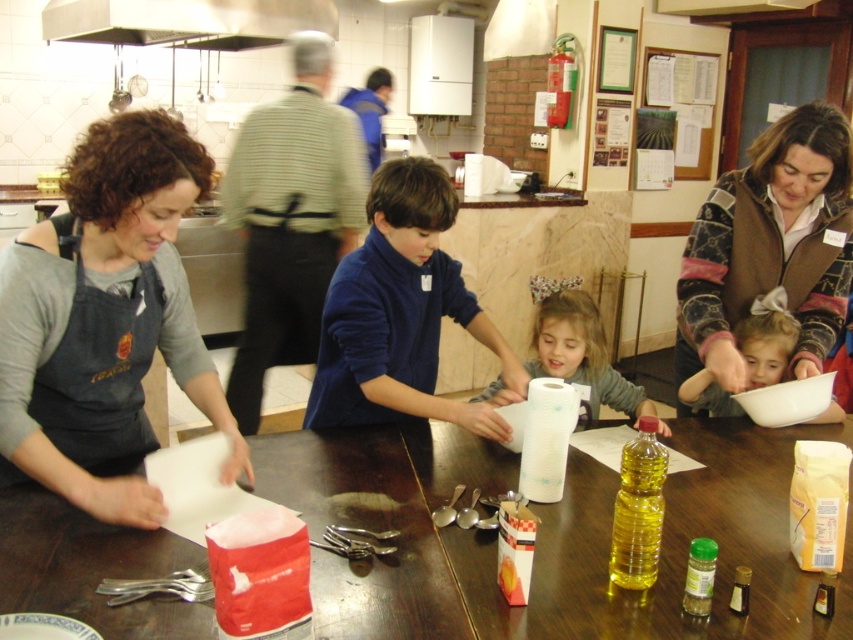
You are a photographer trying to capture a closeup of the dark gray apron at left without the knitted sweater at center blocking it. What should you do?

Move the camera to the left side so that the dark gray apron at left is positioned in front of the knitted sweater at center, ensuring it is not blocked.

You are standing in the community kitchen and want to place the blue fleece sweater at center on the wooden table at center. Can you easily reach the sweater from where you are standing?

The wooden table at center is closer to the viewer than blue fleece sweater at center, so you can easily reach the sweater from where you are standing.